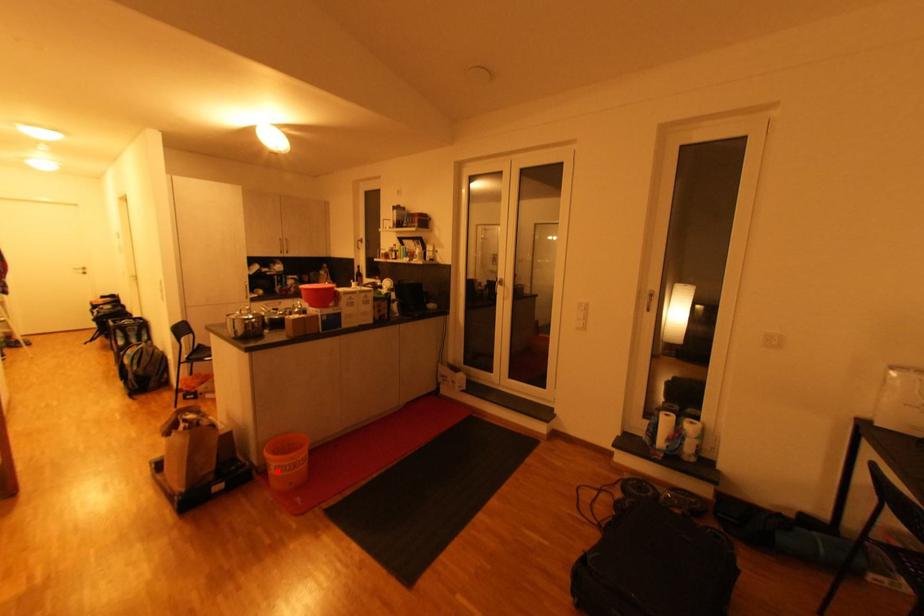
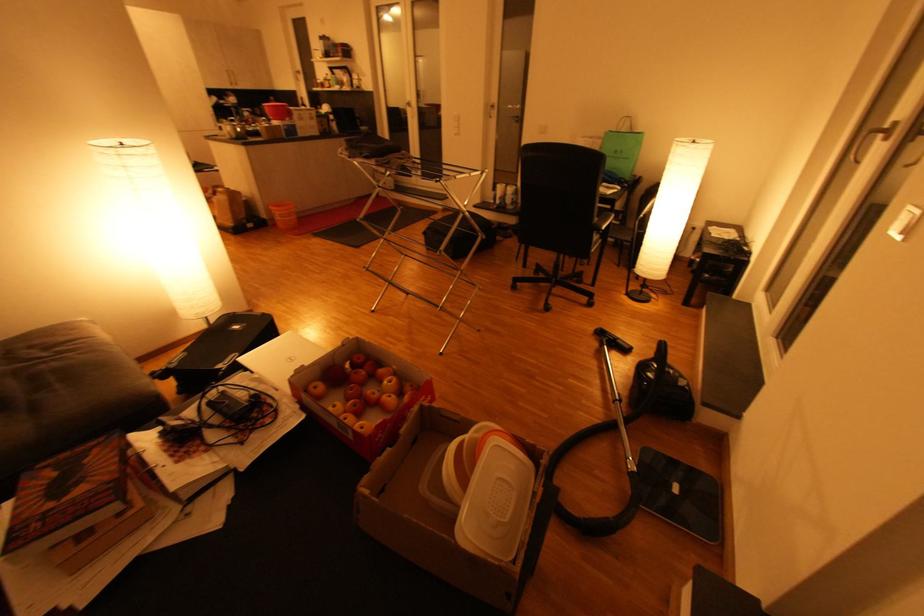
Question: A red point is marked in image1. In image2, is the corresponding 3D point closer to the camera or farther? Reply with the corresponding letter.

Choices:
 (A) The corresponding 3D point is closer.
 (B) The corresponding 3D point is farther.

Answer: (A)